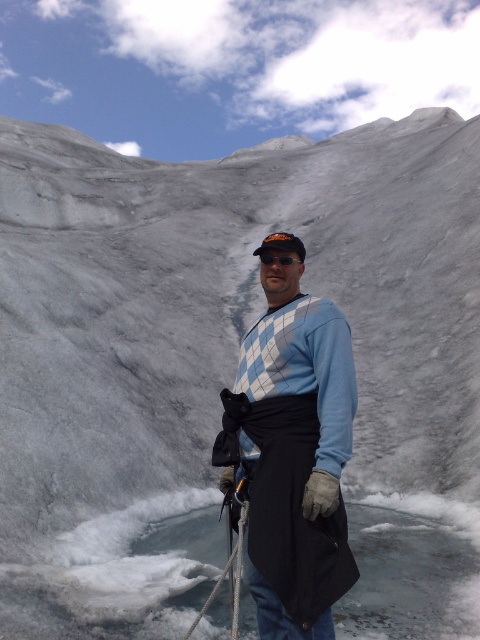
You are a mountaineer planning to secure your position on the glacier. You have a white nylon rope at center. Where exactly should you place the rope to ensure maximum stability according to the coordinates provided?

The white nylon rope at center should be placed at the coordinates (228, 573) to ensure maximum stability as per the provided 2D location.

You are an outdoor guide assessing the safety of a hiker in a glacial environment. The hiker is wearing a blue argyle sweater at center and holding a white nylon rope at center. Based on their positioning, can you determine if the sweater is on the same side as the rope relative to the hiker?

The blue argyle sweater at center is to the right of the white nylon rope at center, so the sweater is on the right side of the rope relative to the hiker.